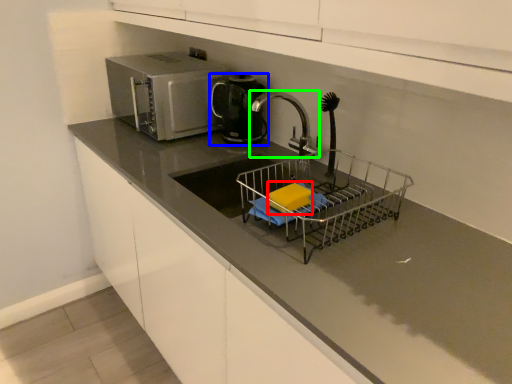
Question: Estimate the real-world distances between objects in this image. Which object is closer to food (highlighted by a red box), kitchen appliance (highlighted by a blue box) or tap (highlighted by a green box)?

Choices:
 (A) kitchen appliance
 (B) tap

Answer: (B)